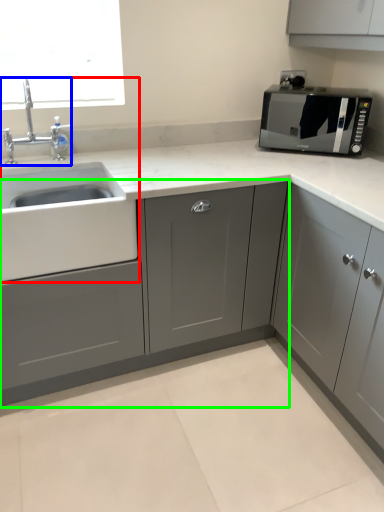
Question: Based on their relative distances, which object is farther from sink (highlighted by a red box)? Choose from tap (highlighted by a blue box) and cabinetry (highlighted by a green box).

Choices:
 (A) tap
 (B) cabinetry

Answer: (B)